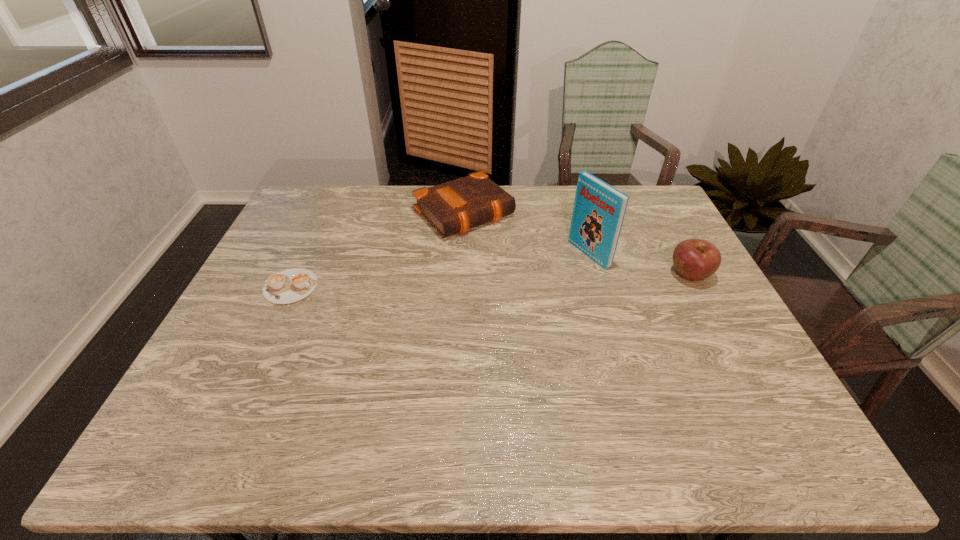
This screenshot has width=960, height=540. Find the location of `vacant space on the desktop that is between the shortest object and the apple and is positioned on the front cover of the book`. vacant space on the desktop that is between the shortest object and the apple and is positioned on the front cover of the book is located at coordinates (535, 279).

In order to click on free space on the desktop that is between the shortest object and the rightmost object and is positioned on the spine side of the third object from right to left in this screenshot , I will do `click(535, 279)`.